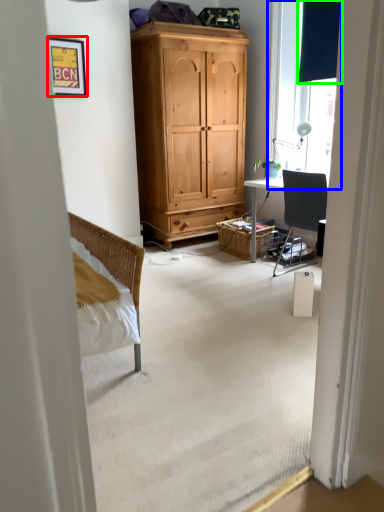
Question: Estimate the real-world distances between objects in this image. Which object is farther from picture frame (highlighted by a red box), window (highlighted by a blue box) or curtain (highlighted by a green box)?

Choices:
 (A) window
 (B) curtain

Answer: (B)